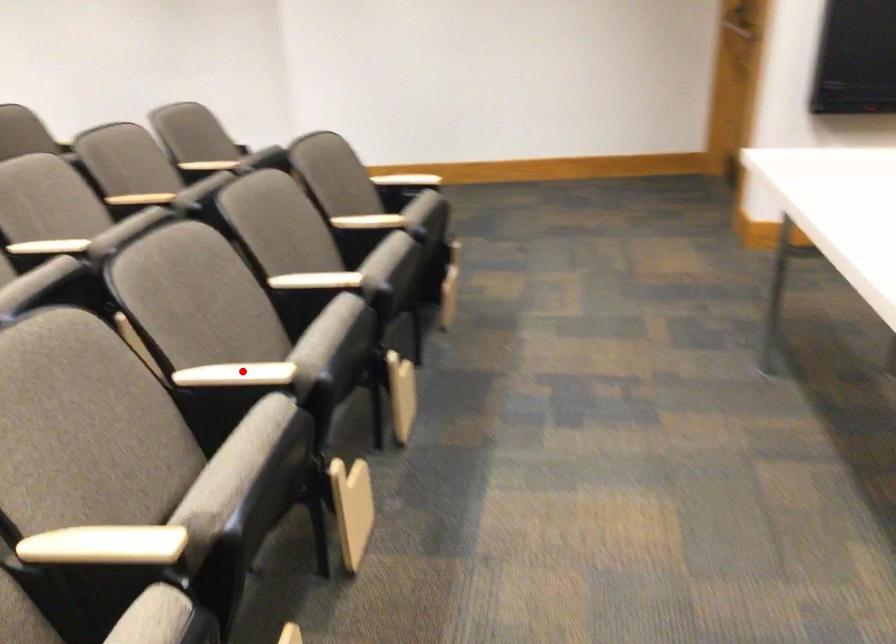
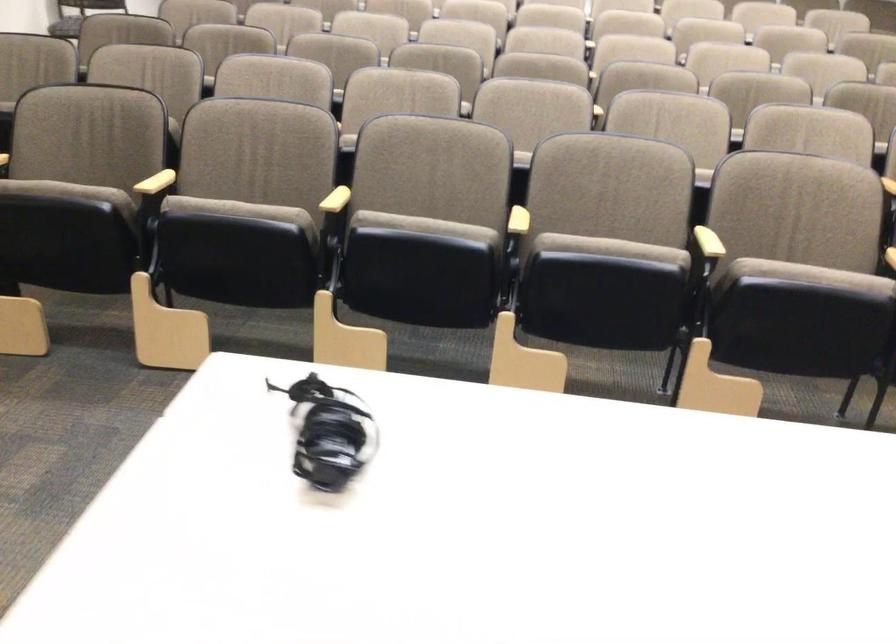
Question: I am providing you with two images of the same scene from different viewpoints. In image1, a red point is highlighted. Considering the same 3D point in image2, which of the following is correct?

Choices:
 (A) It is closer
 (B) It is farther

Answer: (B)